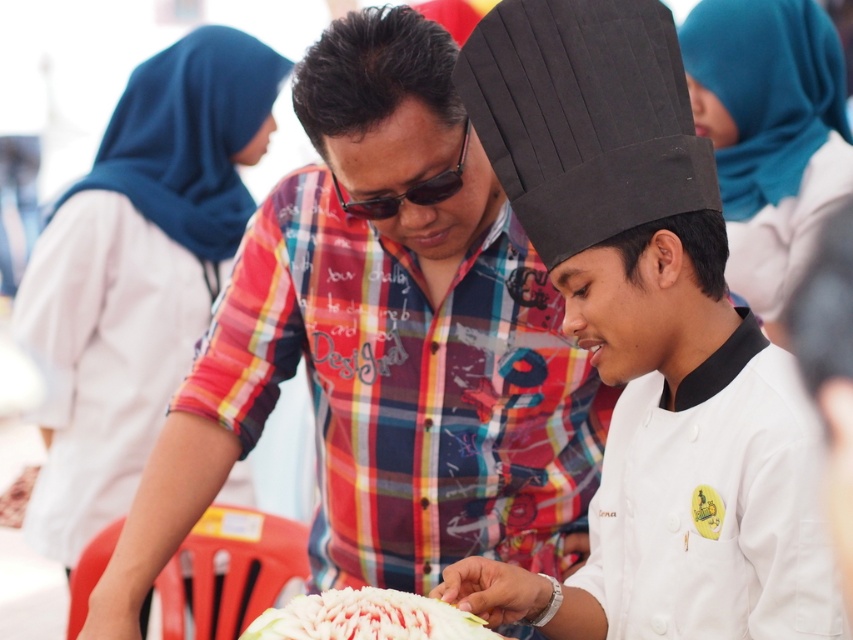
You are standing in the kitchen and see two points marked in the scene. Which point, point (x=793, y=262) or point (x=247, y=632), is closer to you?

Point (x=793, y=262) is closer to you because it is further to the viewer than point (x=247, y=632).